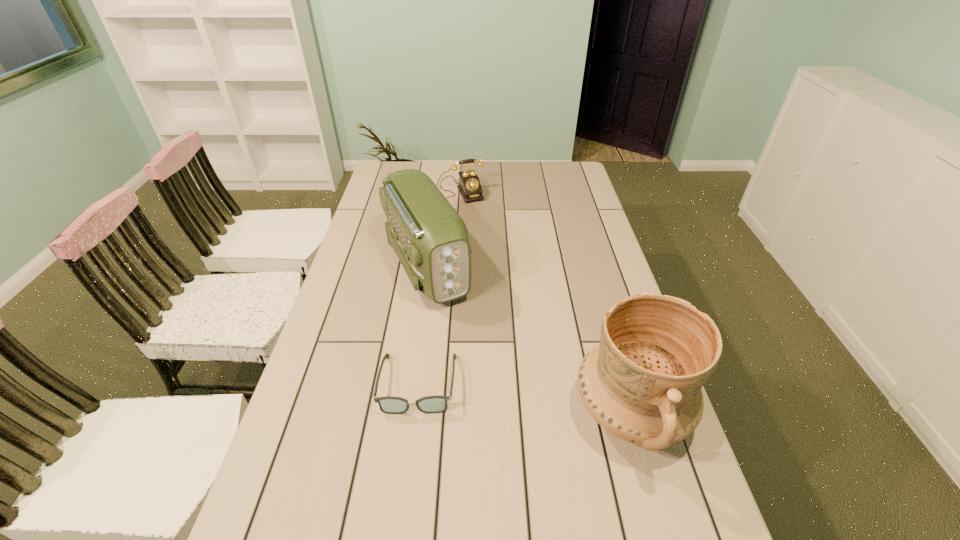
In order to click on free spot that satisfies the following two spatial constraints: 1. on the back side of the telephone; 2. on the right side of the third nearest object in this screenshot , I will do `click(437, 190)`.